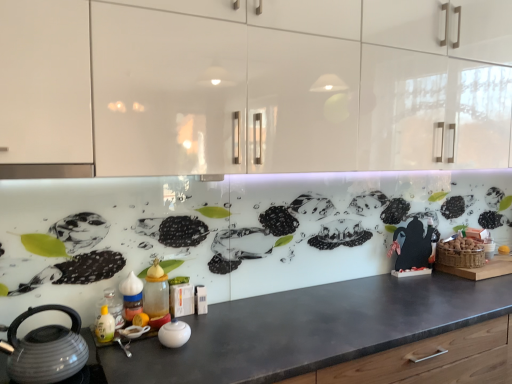
Locate an element on the screen. vacant point to the right of white glossy bowl at center is located at coordinates (221, 340).